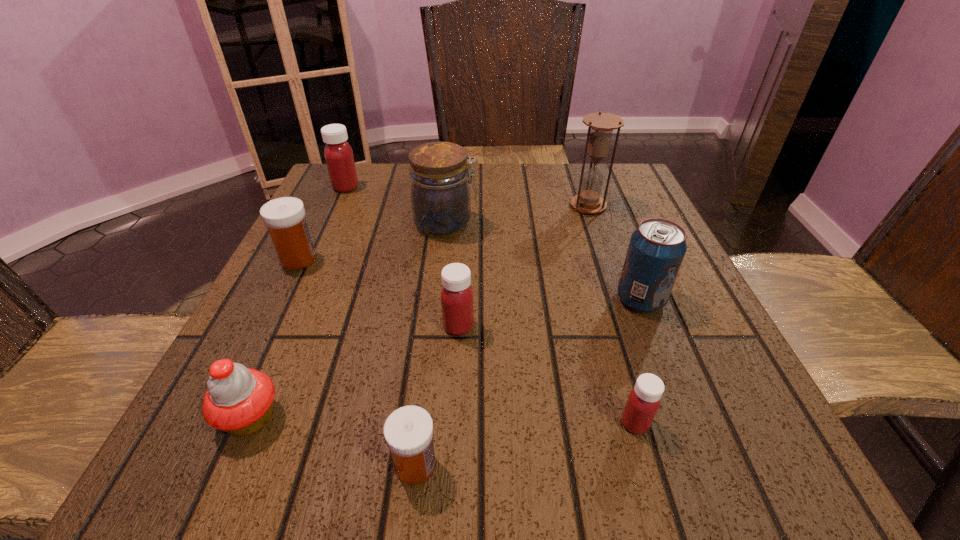
This screenshot has height=540, width=960. I want to click on the tallest object, so click(x=601, y=125).

This screenshot has height=540, width=960. Find the location of `brown hourglass`. brown hourglass is located at coordinates (601, 125).

Identify the location of jar. The width and height of the screenshot is (960, 540). (440, 197).

Where is `the tallest medicine`? the tallest medicine is located at coordinates (338, 154).

You are a GUI agent. You are given a task and a screenshot of the screen. Output one action in this format:
    pyautogui.click(x=<x>, y=<y>)
    Task: Click on the farthest medicine
    The width and height of the screenshot is (960, 540).
    Given the screenshot: What is the action you would take?
    pyautogui.click(x=338, y=154)

The height and width of the screenshot is (540, 960). I want to click on pop soda, so click(656, 250).

Find the location of `the fourth farthest object`. the fourth farthest object is located at coordinates (284, 217).

Locate an element on the screen. the bigger white medicine is located at coordinates (284, 217).

This screenshot has height=540, width=960. Identify the location of the second nearest red medicine. (457, 306).

This screenshot has height=540, width=960. What are the coordinates of `the second smallest red medicine` in the screenshot? It's located at (457, 306).